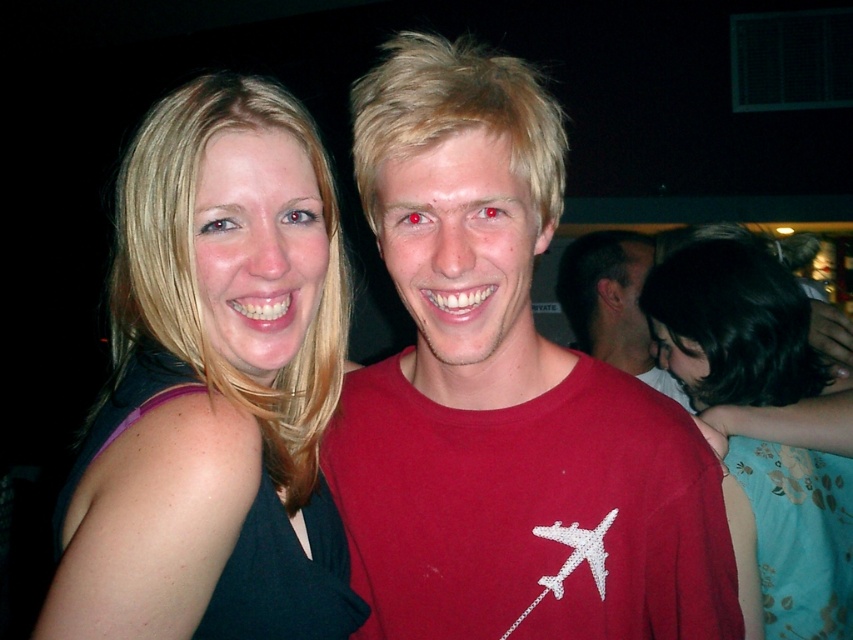
You are organizing a clothing display and need to arrange the red matte shirt at center and the floral fabric dress at right based on their sizes. Which item should be placed first if you want to arrange them from smallest to largest?

The red matte shirt at center is smaller than the floral fabric dress at right, so you should place the red matte shirt at center first followed by the floral fabric dress at right.

You are organizing a photo shoot and need to ensure that the red matte shirt at center and the floral fabric dress at right will fit within a 1.5 meter wide backdrop. Given their widths, will both items fit side by side without overlapping?

The red matte shirt at center is wider than the floral fabric dress at right, but together their combined width may exceed 1.5 meters. To determine if they fit, you need to know the exact widths of both items.